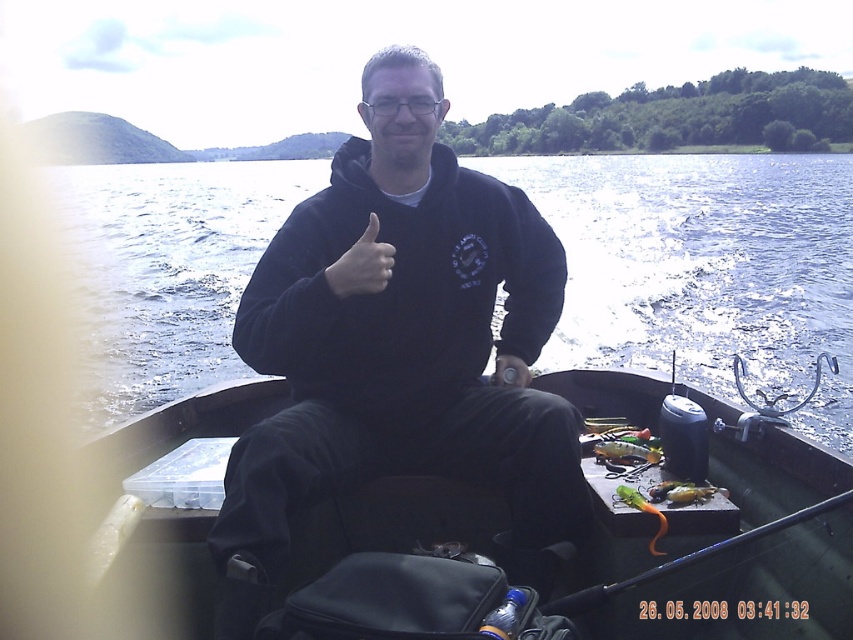
You are a fisherman who wants to reach the orange rubber fishing pole at center from the black matte boat at center. Can you easily reach it without moving your body?

The black matte boat at center and orange rubber fishing pole at center are 14.82 inches apart from each other, so yes, the fisherman can easily reach the orange rubber fishing pole at center without moving their body since the distance is within a typical arm reach.

You are a photographer trying to capture a closeup of the orange rubber fishing pole at center. Given that you need to be within 7 feet to get a clear shot, can you take the photo from your current position?

The orange rubber fishing pole at center is 6.85 feet away from the camera, which is within the 7 feet requirement. Yes, you can take the photo from your current position.

You are a fisherman who just caught a fish. You want to put it in the bucket located at the front of the boat. The bucket is at point 0.9, 0.9. Your current position is at point (686, 560). Which direction should you move to reach the bucket?

The bucket is located at point 0.9, 0.9, and your current position is at point (686, 560). To reach the bucket, you should move northeast since the bucket is northeast of your current position.